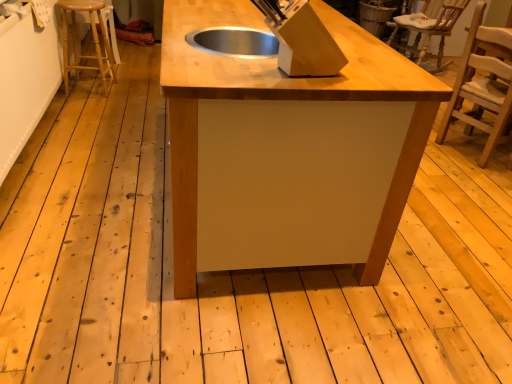
I want to click on free space below light brown wooden stool at left (from a real-world perspective), so click(92, 93).